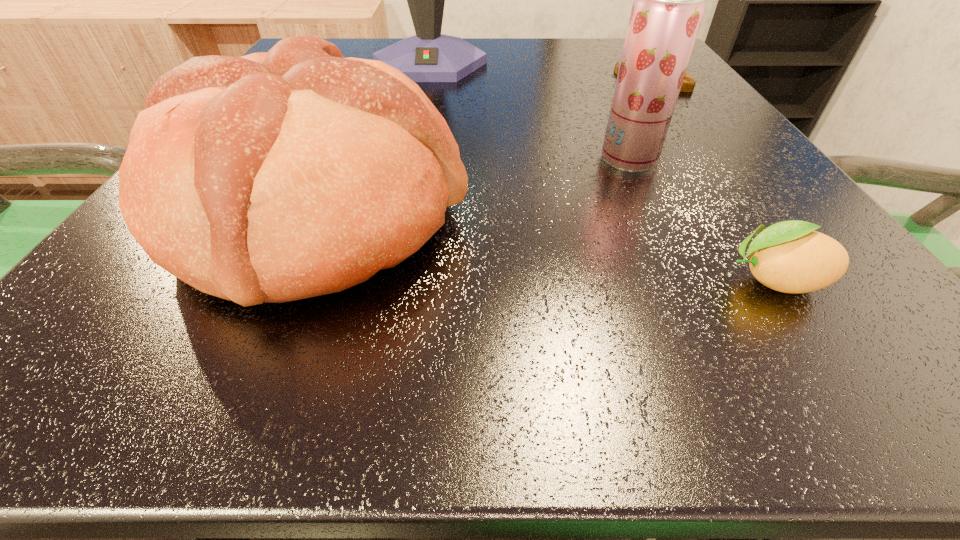
Locate an element on the screen. vacant space located with leaves positioned above the lemon is located at coordinates (441, 280).

Image resolution: width=960 pixels, height=540 pixels. In order to click on free location located with leaves positioned above the lemon in this screenshot , I will do `click(450, 280)`.

Identify the location of lampshade that is at the far edge. (429, 56).

Locate an element on the screen. figurine situated at the far edge is located at coordinates (688, 84).

The image size is (960, 540). What are the coordinates of `object that is at the near edge` in the screenshot? It's located at (x=276, y=176).

You are a GUI agent. You are given a task and a screenshot of the screen. Output one action in this format:
    pyautogui.click(x=<x>, y=<y>)
    Task: Click on the lampshade that is at the left edge
    
    Given the screenshot: What is the action you would take?
    pyautogui.click(x=429, y=56)

Find the location of `bread positioned at the left edge`. bread positioned at the left edge is located at coordinates (276, 176).

You are a GUI agent. You are given a task and a screenshot of the screen. Output one action in this format:
    pyautogui.click(x=<x>, y=<y>)
    Task: Click on the figurine present at the right edge
    The width and height of the screenshot is (960, 540).
    Given the screenshot: What is the action you would take?
    pyautogui.click(x=688, y=84)

I want to click on fruit juice that is at the right edge, so click(x=669, y=0).

Identify the location of lemon present at the right edge. This screenshot has width=960, height=540. (790, 257).